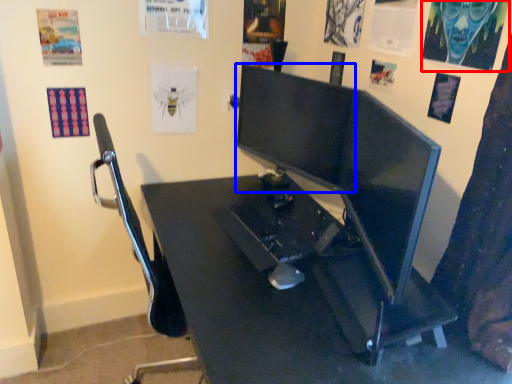
Question: Which object appears closest to the camera in this image, poster page (highlighted by a red box) or computer monitor (highlighted by a blue box)?

Choices:
 (A) poster page
 (B) computer monitor

Answer: (A)